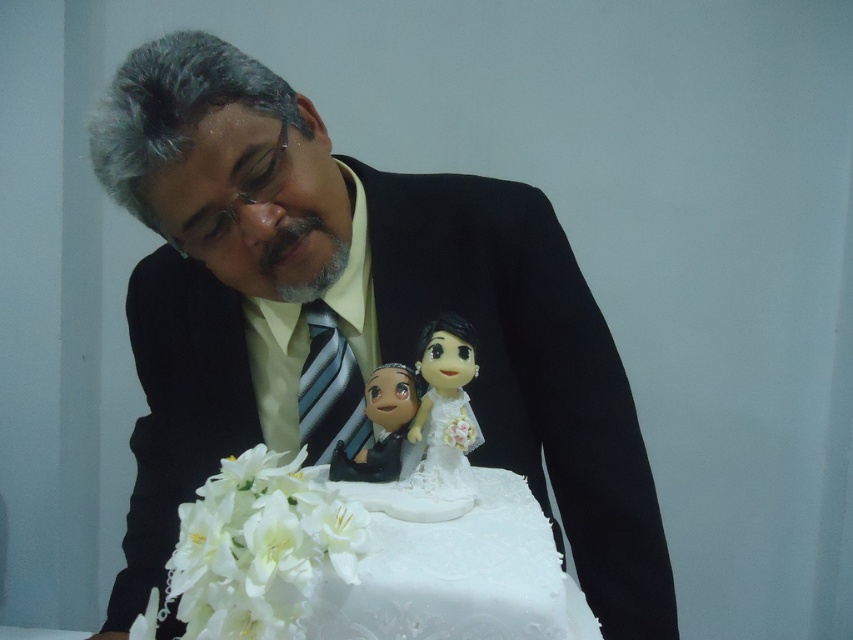
Question: Is matte black suit at center behind white glossy wedding cake at center?

Choices:
 (A) yes
 (B) no

Answer: (A)

Question: Is white glossy wedding cake at center to the right of matte plastic figurine at center from the viewer's perspective?

Choices:
 (A) no
 (B) yes

Answer: (B)

Question: Which object is closer to the camera taking this photo?

Choices:
 (A) white glossy wedding cake at center
 (B) porcelain doll at center
 (C) matte black suit at center

Answer: (A)

Question: Which point is farther to the camera?

Choices:
 (A) (463, 324)
 (B) (381, 378)

Answer: (B)

Question: Is matte black suit at center bigger than white glossy wedding cake at center?

Choices:
 (A) no
 (B) yes

Answer: (B)

Question: Which object is the closest to the matte plastic figurine at center?

Choices:
 (A) porcelain doll at center
 (B) white glossy wedding cake at center
 (C) matte black suit at center

Answer: (A)